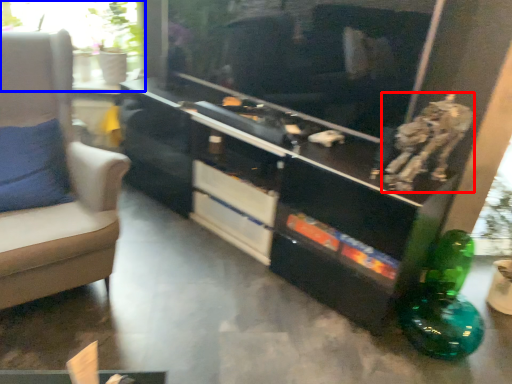
Question: Which object is closer to the camera taking this photo, animal (highlighted by a red box) or window (highlighted by a blue box)?

Choices:
 (A) animal
 (B) window

Answer: (A)